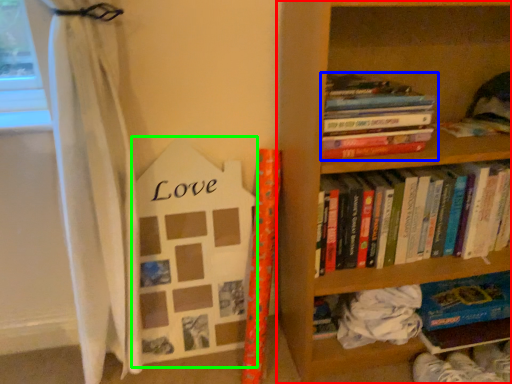
Question: Which object is the closest to the bookcase (highlighted by a red box)? Choose among these: book (highlighted by a blue box) or paperback book (highlighted by a green box).

Choices:
 (A) book
 (B) paperback book

Answer: (A)